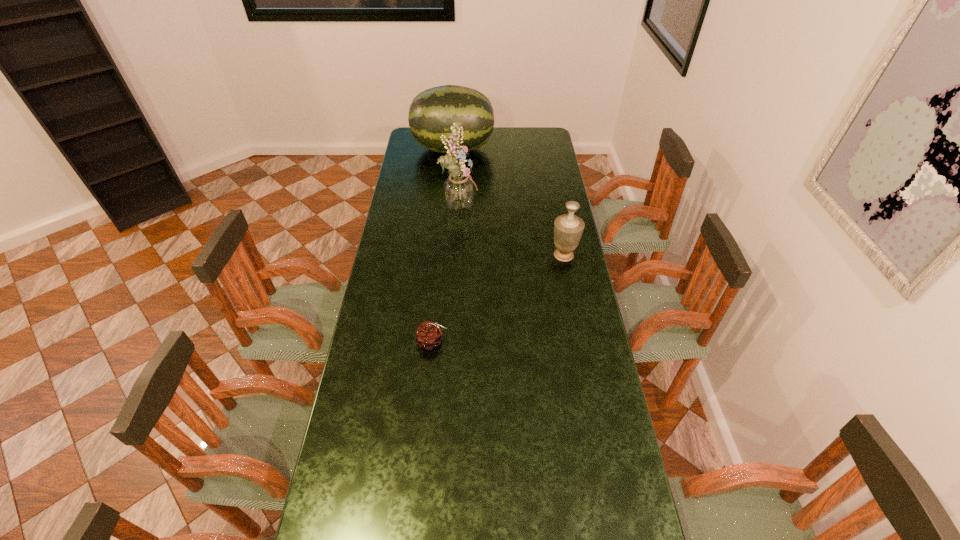
Find the location of a particular element. bouquet is located at coordinates (459, 190).

At what (x,y) coordinates should I click in order to perform the action: click on the tallest object. Please return your answer as a coordinate pair (x, y). Looking at the image, I should click on (459, 190).

Identify the location of watermelon. (432, 112).

Image resolution: width=960 pixels, height=540 pixels. What are the coordinates of `the farthest object` in the screenshot? It's located at (432, 112).

The image size is (960, 540). In order to click on the third farthest object in this screenshot , I will do `click(568, 228)`.

The image size is (960, 540). I want to click on the third tallest object, so click(x=568, y=228).

Where is `the shortest object`? the shortest object is located at coordinates (429, 335).

Identify the location of the nearest object. The width and height of the screenshot is (960, 540). (429, 335).

You are a GUI agent. You are given a task and a screenshot of the screen. Output one action in this format:
    pyautogui.click(x=<x>, y=<y>)
    Task: Click on the vacant space located 0.300m on the front-facing side of the tallest object
    The width and height of the screenshot is (960, 540).
    Given the screenshot: What is the action you would take?
    pyautogui.click(x=543, y=206)

Locate an element on the screen. Image resolution: width=960 pixels, height=540 pixels. vacant space located 0.070m on the front of the second tallest object is located at coordinates (451, 174).